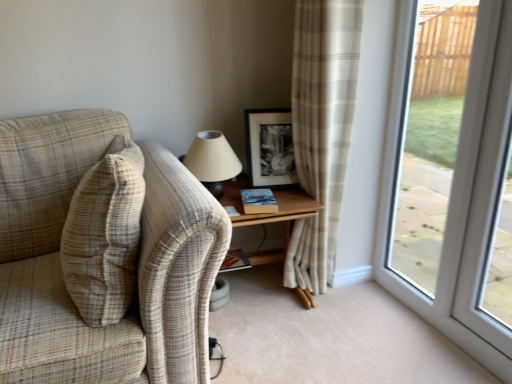
Identify the location of free spot in front of wooden table at center. The width and height of the screenshot is (512, 384). (289, 349).